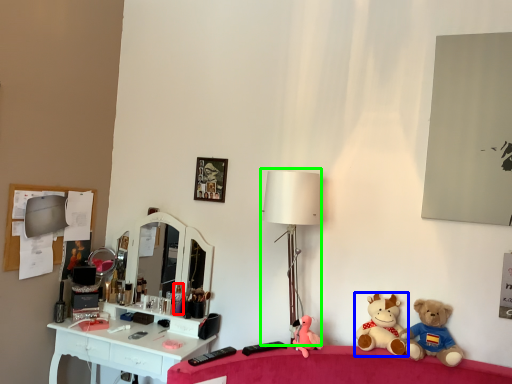
Question: Which object is the closest to the toiletry (highlighted by a red box)? Choose among these: toy (highlighted by a blue box) or table lamp (highlighted by a green box).

Choices:
 (A) toy
 (B) table lamp

Answer: (B)